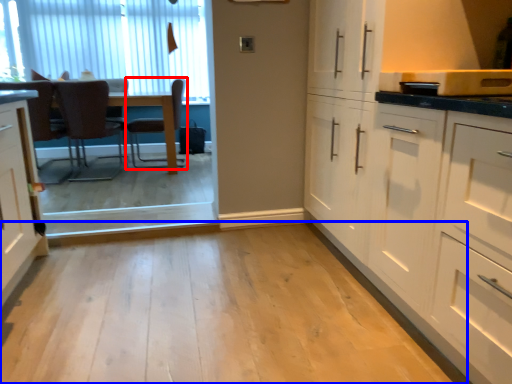
Question: Which of the following is the farthest to the observer, chair (highlighted by a red box) or plain (highlighted by a blue box)?

Choices:
 (A) chair
 (B) plain

Answer: (A)